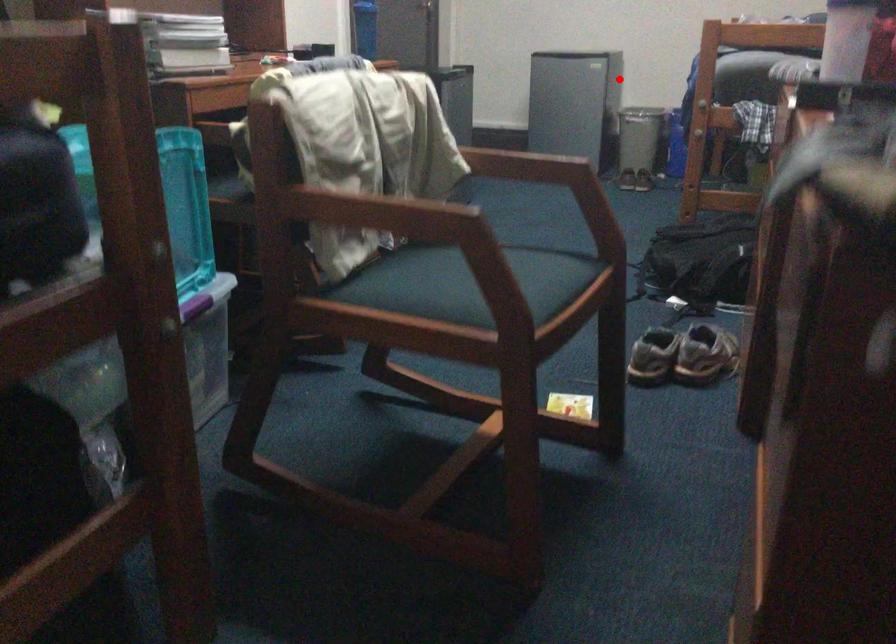
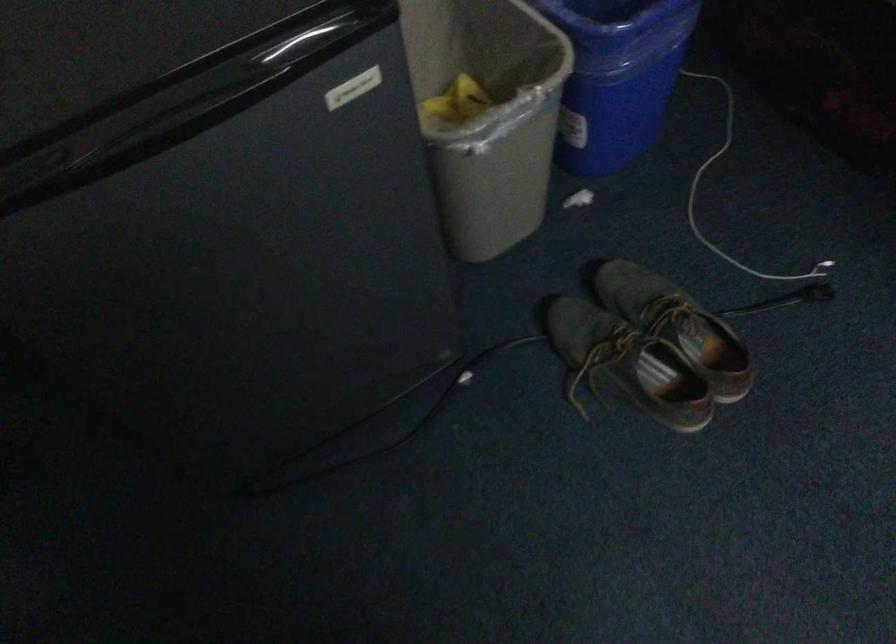
Question: I am providing you with two images of the same scene from different viewpoints. Image1 has a red point marked. In image2, the corresponding 3D location appears at what relative position? Reply with the corresponding letter.

Choices:
 (A) Closer
 (B) Farther

Answer: (A)